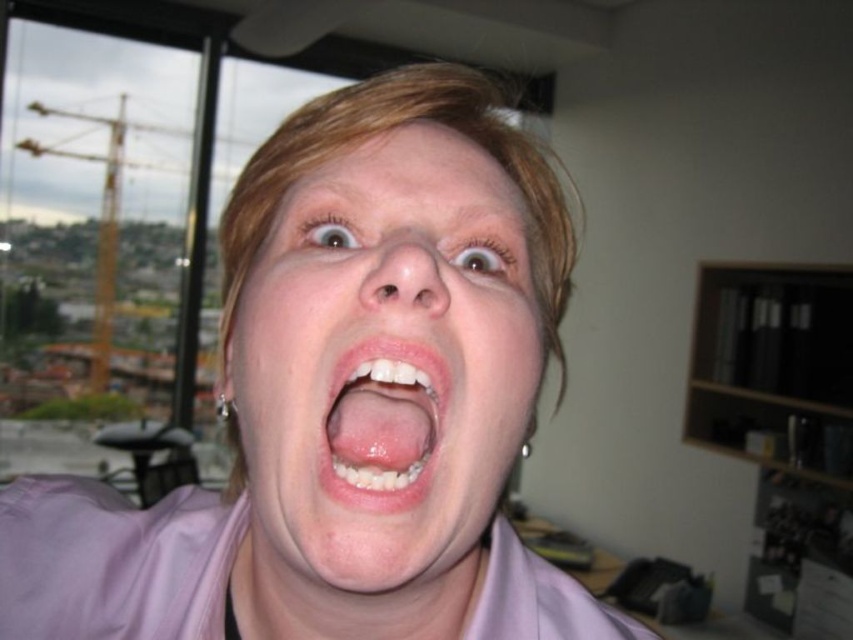
Question: Is the position of pink satin shirt at center less distant than that of smooth skin face at center?

Choices:
 (A) no
 (B) yes

Answer: (B)

Question: Based on their relative distances, which object is farther from the pink glossy lips at center?

Choices:
 (A) pink satin shirt at center
 (B) smooth skin face at center

Answer: (A)

Question: Can you confirm if pink satin shirt at center is positioned above pink glossy lips at center?

Choices:
 (A) no
 (B) yes

Answer: (A)

Question: Which object appears farthest from the camera in this image?

Choices:
 (A) pink satin shirt at center
 (B) smooth skin face at center

Answer: (B)

Question: Which point is farther to the camera?

Choices:
 (A) (389, 154)
 (B) (398, 401)
 (C) (369, 342)

Answer: (B)

Question: Can you confirm if smooth skin face at center is positioned to the left of pink glossy lips at center?

Choices:
 (A) no
 (B) yes

Answer: (A)